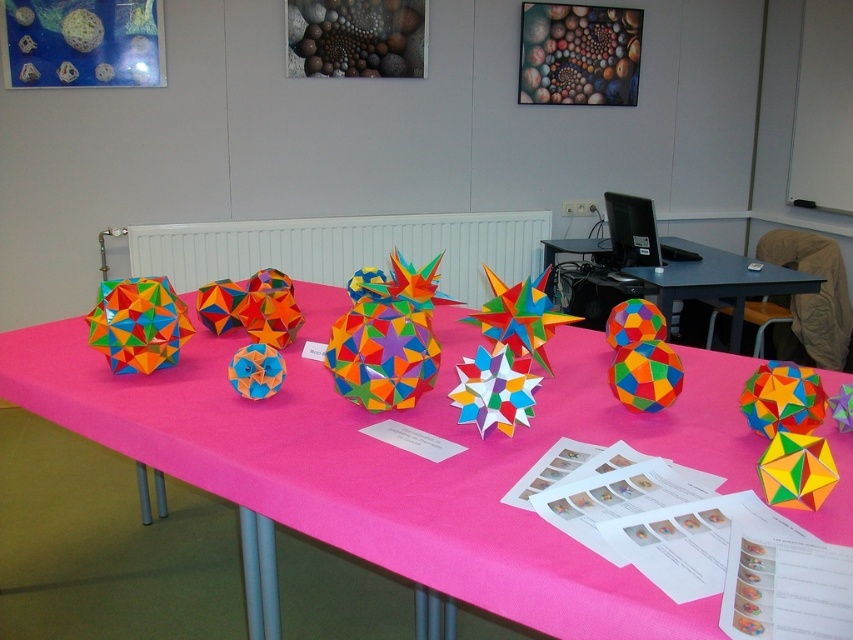
Can you confirm if multicolored paper at center is positioned below multicolored paper star at center?

Yes.

The height and width of the screenshot is (640, 853). What do you see at coordinates (403, 460) in the screenshot?
I see `multicolored paper at center` at bounding box center [403, 460].

You are a GUI agent. You are given a task and a screenshot of the screen. Output one action in this format:
    pyautogui.click(x=<x>, y=<y>)
    Task: Click on the multicolored paper at center
    This screenshot has height=640, width=853.
    Given the screenshot: What is the action you would take?
    pyautogui.click(x=403, y=460)